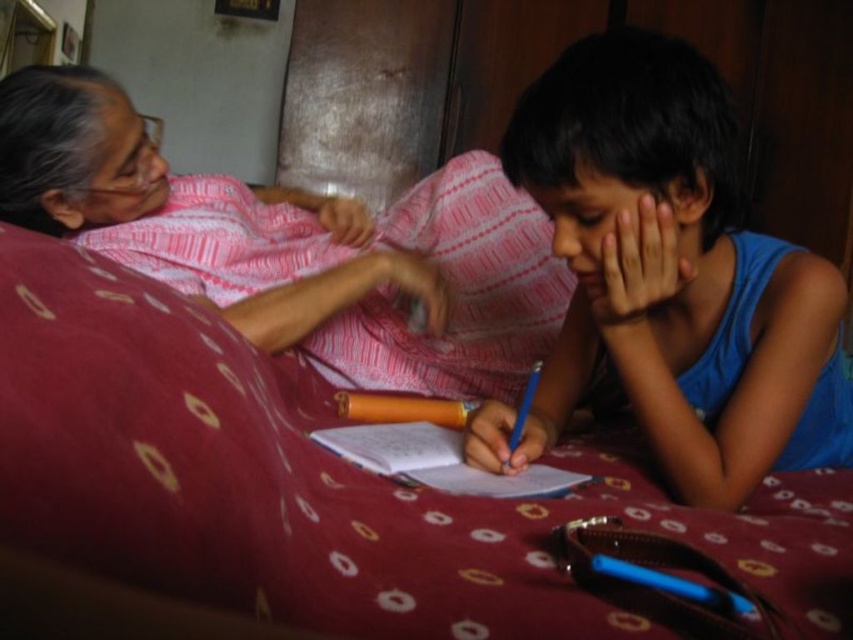
You are a furniture designer who needs to place a new 18 inch wide decorative item between the maroon fabric bed at center and the matte pink fabric at upper left. Can the item fit in the space between them?

The distance between the maroon fabric bed at center and the matte pink fabric at upper left is 19.25 inches. Since the decorative item is 18 inches wide, it can fit in the space between them as there is enough room.

You are designing a room layout and need to place the maroon fabric bed at center and the matte pink fabric at upper left. Based on their sizes, which object should be placed closer to the ceiling to avoid blocking the window?

The matte pink fabric at upper left should be placed closer to the ceiling since it is taller than the maroon fabric bed at center, so positioning it higher up would prevent it from blocking the window.

You are standing at the point marked by the coordinates point (740, 465). You want to reach the door located at the opposite side of the room. There is an obstacle 30.55 inches away from your current position. Can you walk straight to the door without encountering the obstacle?

Since the obstacle is 30.55 inches away from your current position at point (740, 465), you would encounter it before reaching the door. Therefore, you cannot walk straight to the door without encountering the obstacle.